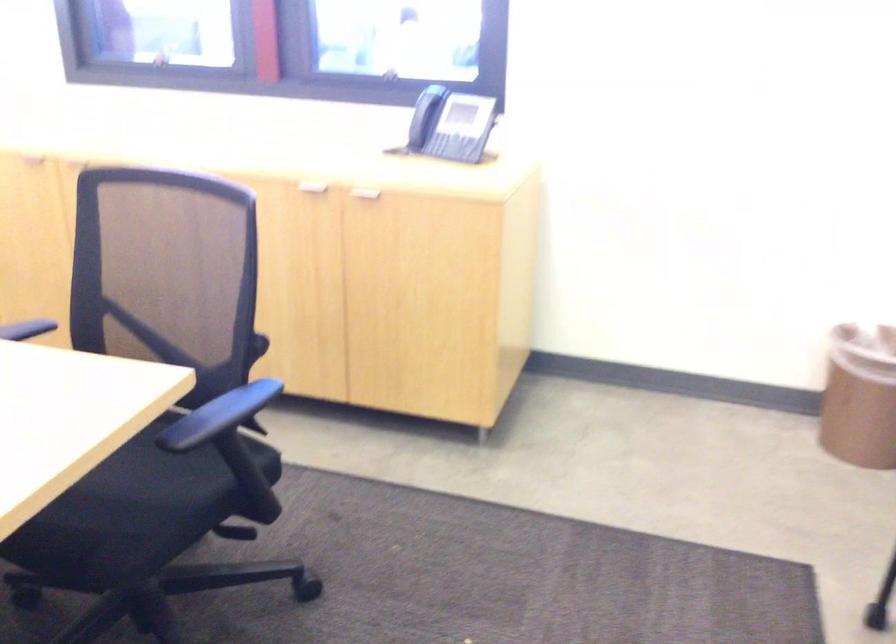
This screenshot has height=644, width=896. In order to click on chair sitting surface in this screenshot , I will do [x=124, y=498].